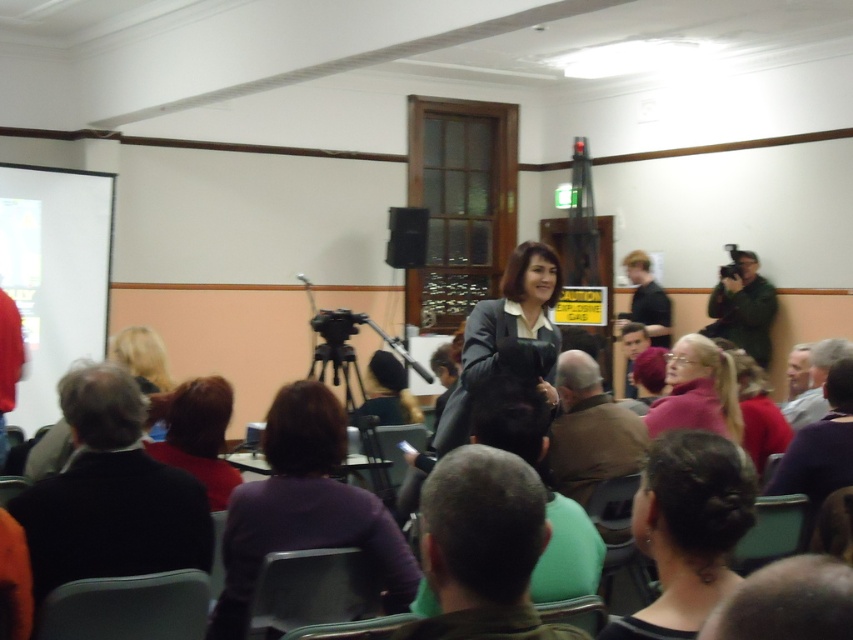
Question: Which of the following is the closest to the observer?

Choices:
 (A) matte purple shirt at lower left
 (B) green fabric head at center
 (C) black fabric jacket at lower left
 (D) green fabric camera at upper right

Answer: (B)

Question: Which object is positioned closest to the black hair bun at lower right?

Choices:
 (A) dark purple sweater at center
 (B) black fabric jacket at lower left

Answer: (B)

Question: Is the position of purple fabric at center less distant than that of matte purple shirt at lower left?

Choices:
 (A) yes
 (B) no

Answer: (A)

Question: From the image, what is the correct spatial relationship of black hair bun at lower right in relation to matte purple shirt at lower left?

Choices:
 (A) above
 (B) below

Answer: (A)

Question: Which point is closer to the camera?

Choices:
 (A) (648, 314)
 (B) (413, 577)
 (C) (553, 324)

Answer: (B)

Question: Is purple fabric at center further to camera compared to matte purple shirt at lower left?

Choices:
 (A) yes
 (B) no

Answer: (B)